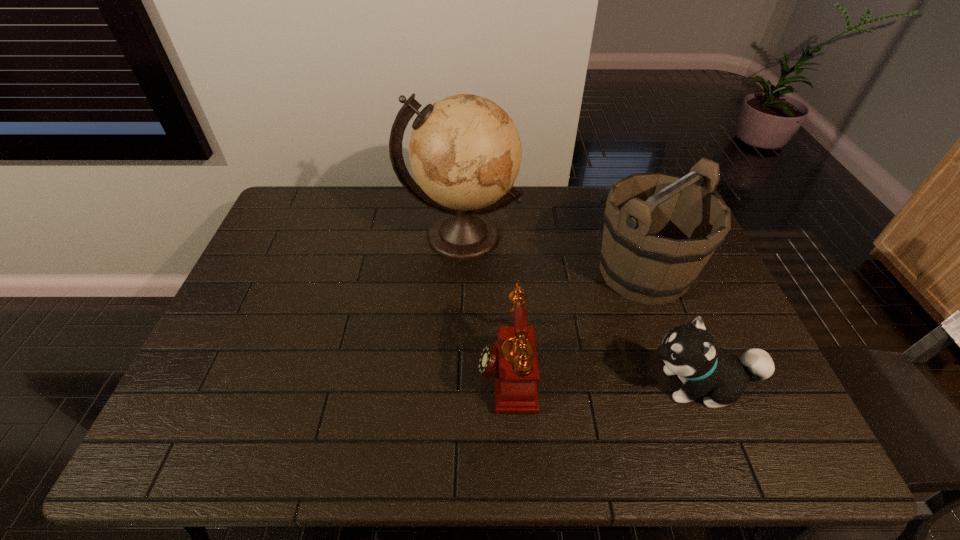
Where is `free space located 0.100m at the face of the puppy`? free space located 0.100m at the face of the puppy is located at coordinates (600, 385).

Locate an element on the screen. The image size is (960, 540). free space located 0.350m at the face of the puppy is located at coordinates (496, 385).

Locate an element on the screen. Image resolution: width=960 pixels, height=540 pixels. object that is at the far edge is located at coordinates (465, 152).

The width and height of the screenshot is (960, 540). Identify the location of bucket present at the right edge. (660, 230).

This screenshot has height=540, width=960. I want to click on puppy that is at the right edge, so click(689, 351).

Locate an element on the screen. free space at the far edge is located at coordinates (554, 195).

Where is `free space at the near edge`? free space at the near edge is located at coordinates (244, 461).

The width and height of the screenshot is (960, 540). Identify the location of unoccupied area between the puppy and the tallest object. (580, 310).

You are a GUI agent. You are given a task and a screenshot of the screen. Output one action in this format:
    pyautogui.click(x=<x>, y=<y>)
    Task: Click on the free space between the telephone and the tallest object
    Image resolution: width=960 pixels, height=540 pixels.
    Given the screenshot: What is the action you would take?
    coord(484,302)

At what (x,y) coordinates should I click in order to perform the action: click on unoccupied area between the telephone and the puppy. Please return your answer as a coordinate pair (x, y). This screenshot has height=540, width=960. Looking at the image, I should click on (603, 377).